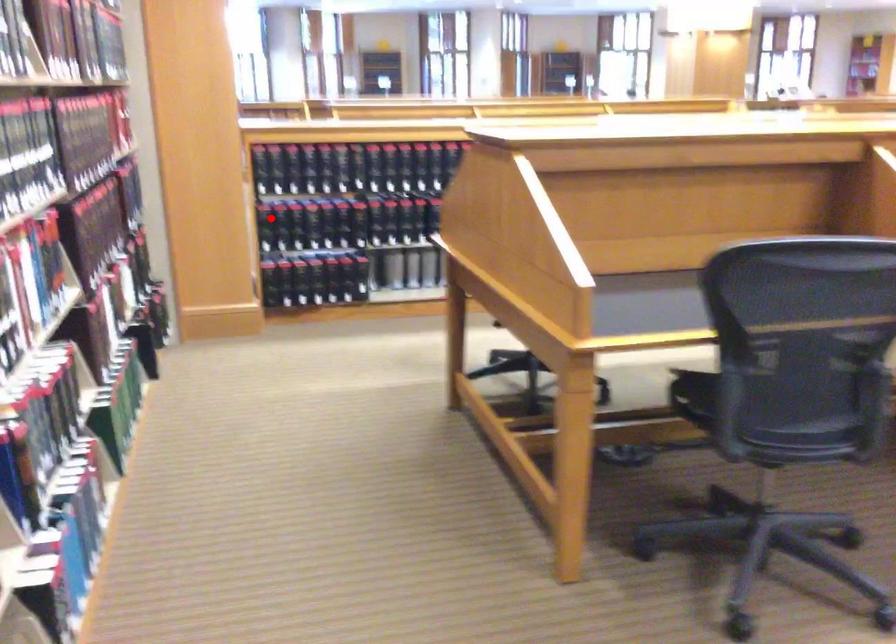
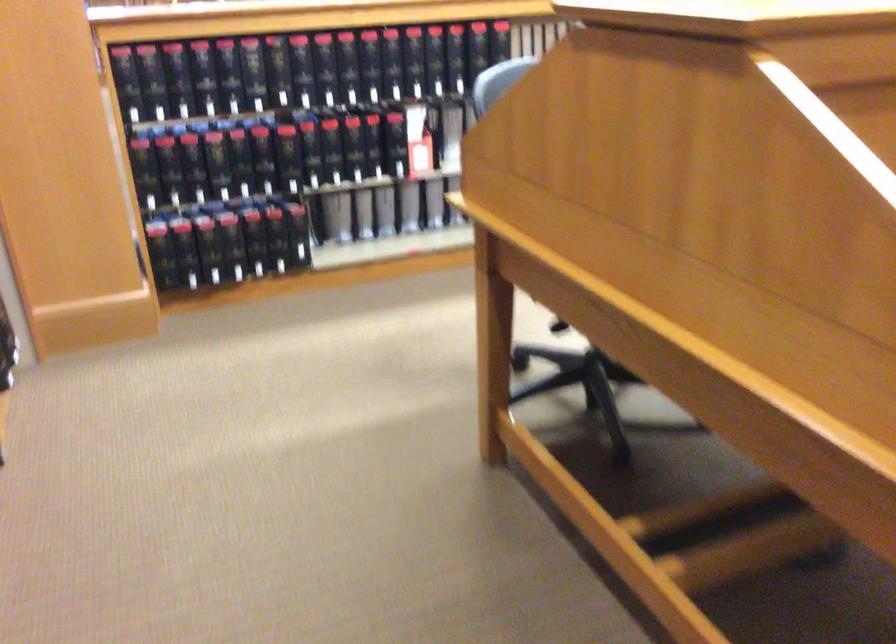
Question: I am providing you with two images of the same scene from different viewpoints. Image1 has a red point marked. In image2, the corresponding 3D location appears at what relative position? Reply with the corresponding letter.

Choices:
 (A) Closer
 (B) Farther

Answer: (A)